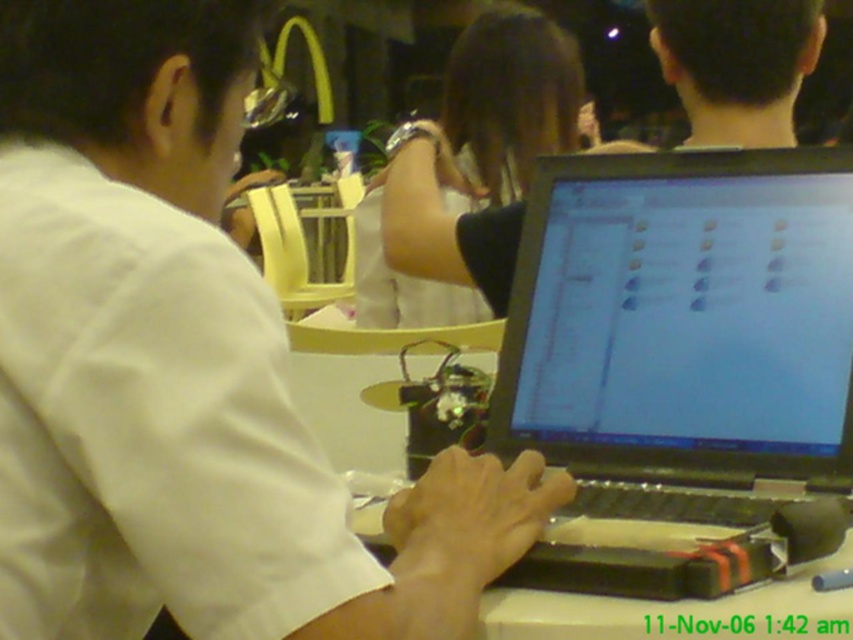
Question: Does matte black laptop at center appear over black matte laptop at center?

Choices:
 (A) yes
 (B) no

Answer: (B)

Question: Which object is closer to the camera taking this photo?

Choices:
 (A) white matte laptop at center
 (B) matte black laptop at center
 (C) dark hair at upper right

Answer: (A)

Question: Which point is closer to the camera?

Choices:
 (A) (479, 109)
 (B) (729, 449)
 (C) (125, 532)

Answer: (C)

Question: Is matte black laptop at center bigger than black matte laptop at center?

Choices:
 (A) no
 (B) yes

Answer: (A)

Question: Among these points, which one is nearest to the camera?

Choices:
 (A) (521, 72)
 (B) (785, 113)
 (C) (495, 444)
 (D) (341, 577)

Answer: (D)

Question: Does matte black laptop at center appear on the left side of black matte laptop at center?

Choices:
 (A) no
 (B) yes

Answer: (A)